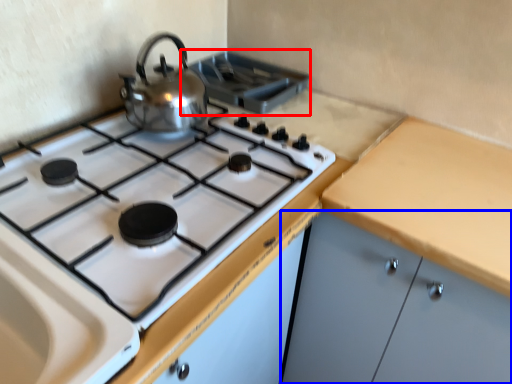
Question: Which point is further to the camera, appliance (highlighted by a red box) or cabinetry (highlighted by a blue box)?

Choices:
 (A) appliance
 (B) cabinetry

Answer: (A)